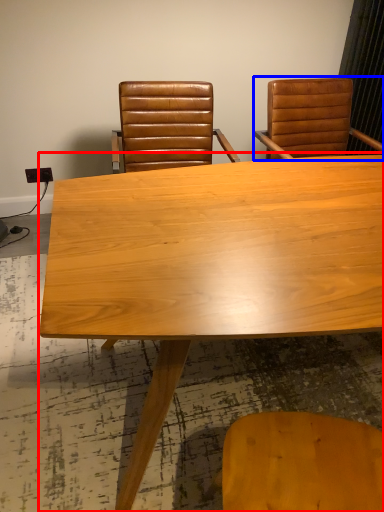
Question: Which point is further to the camera, table (highlighted by a red box) or chair (highlighted by a blue box)?

Choices:
 (A) table
 (B) chair

Answer: (B)